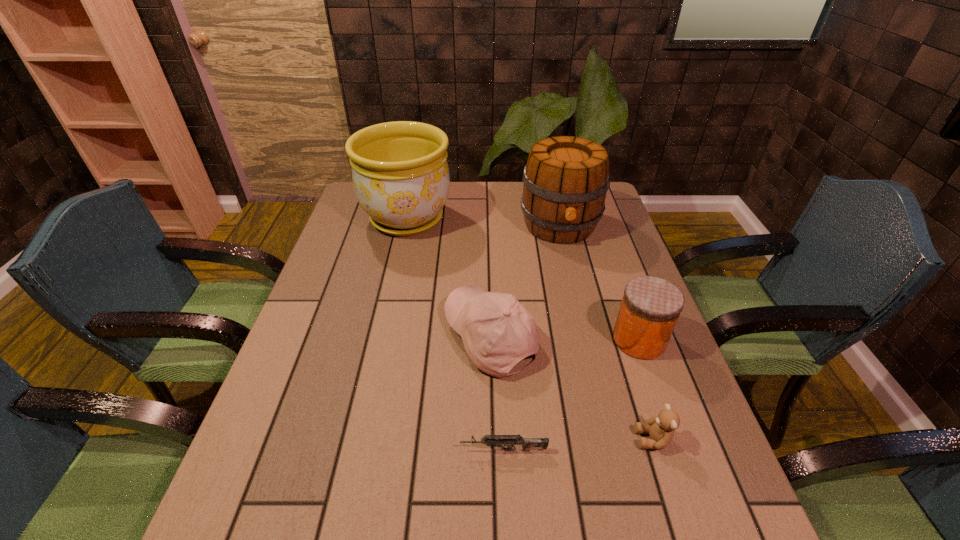
Where is `vacant space that is in between the leftmost object and the jar`? The image size is (960, 540). vacant space that is in between the leftmost object and the jar is located at coordinates (523, 279).

Where is `vacant region between the baseball cap and the teddy bear`? The image size is (960, 540). vacant region between the baseball cap and the teddy bear is located at coordinates (572, 388).

Where is `vacant point located between the flowerpot and the jar`? vacant point located between the flowerpot and the jar is located at coordinates (523, 279).

Where is `empty space between the jar and the cider`? The image size is (960, 540). empty space between the jar and the cider is located at coordinates (599, 283).

At what (x,y) coordinates should I click in order to perform the action: click on free space between the teddy bear and the cider. Please return your answer as a coordinate pair (x, y). Looking at the image, I should click on (607, 333).

Identify the location of free space that is in between the leftmost object and the jar. This screenshot has height=540, width=960. (523, 279).

The height and width of the screenshot is (540, 960). Find the location of `free space between the teddy bear and the shortest object`. free space between the teddy bear and the shortest object is located at coordinates (579, 445).

Identify the location of free area in between the baseball cap and the jar. (564, 339).

Locate an element on the screen. The image size is (960, 540). free area in between the shortest object and the jar is located at coordinates (571, 395).

Find the location of `unoccupied position between the gun and the leftmost object`. unoccupied position between the gun and the leftmost object is located at coordinates (455, 334).